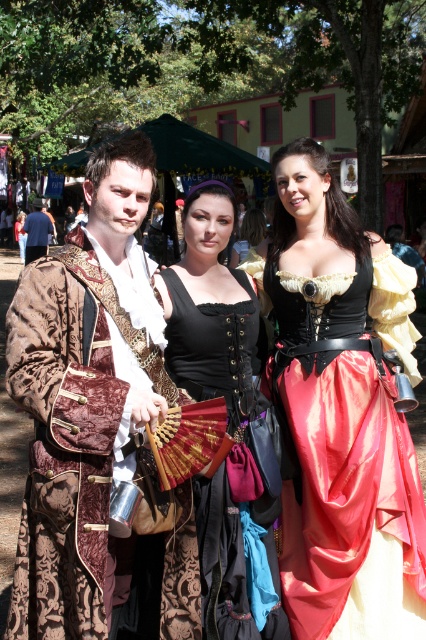
Question: Which object is the farthest from the matte black jacket at center?

Choices:
 (A) velvet brown coat at center
 (B) satin black corset at center
 (C) black velvet dress at center

Answer: (A)

Question: Is satin black corset at center bigger than matte black jacket at center?

Choices:
 (A) no
 (B) yes

Answer: (A)

Question: Which point appears closest to the camera in this image?

Choices:
 (A) (368, 266)
 (B) (203, 282)

Answer: (B)

Question: Can you confirm if black velvet dress at center is positioned to the left of matte black jacket at center?

Choices:
 (A) no
 (B) yes

Answer: (A)

Question: Which point is farther to the camera?

Choices:
 (A) [x=423, y=580]
 (B) [x=224, y=353]

Answer: (B)

Question: Does velvet brown coat at center appear over matte black jacket at center?

Choices:
 (A) no
 (B) yes

Answer: (A)